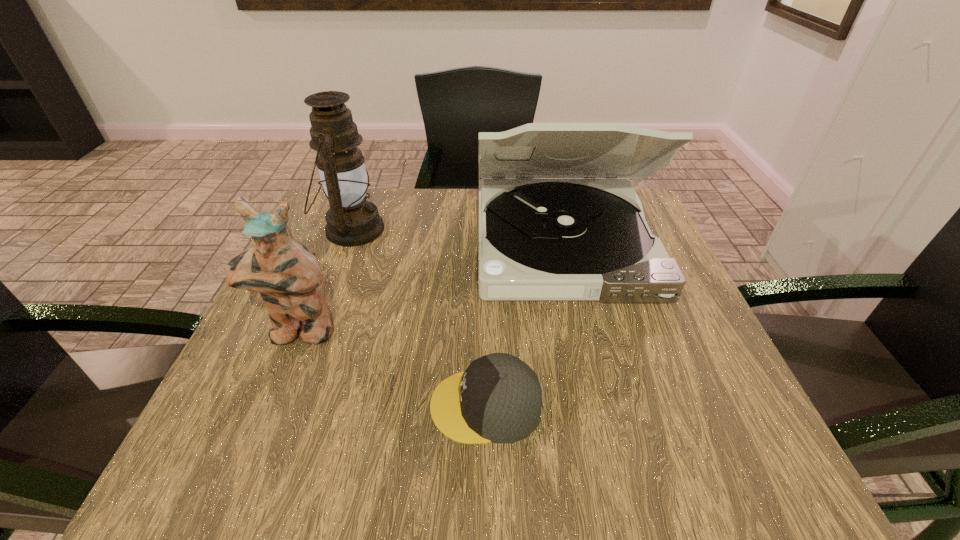
In order to click on blank region between the CD player and the shortest object in this screenshot , I will do `click(524, 324)`.

At what (x,y) coordinates should I click in order to perform the action: click on unoccupied position between the oil lamp and the second nearest object. Please return your answer as a coordinate pair (x, y). The width and height of the screenshot is (960, 540). Looking at the image, I should click on (325, 281).

Locate an element on the screen. This screenshot has width=960, height=540. empty location between the oil lamp and the figurine is located at coordinates (325, 281).

Identify which object is the second closest to the oil lamp. Please provide its 2D coordinates. Your answer should be formatted as a tuple, i.e. [(x, y)], where the tuple contains the x and y coordinates of a point satisfying the conditions above.

[(539, 239)]

Locate which object ranks in proximity to the CD player. Please provide its 2D coordinates. Your answer should be formatted as a tuple, i.e. [(x, y)], where the tuple contains the x and y coordinates of a point satisfying the conditions above.

[(498, 399)]